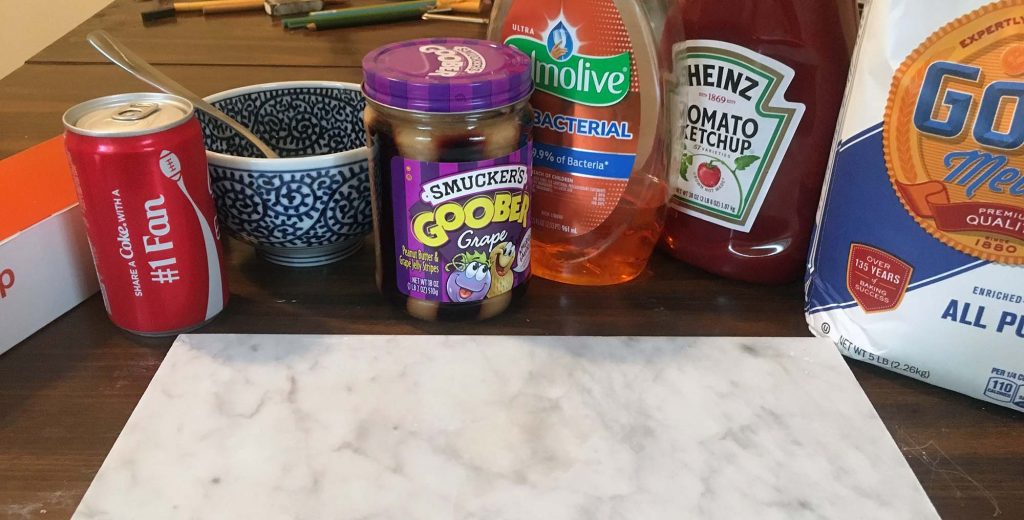
This screenshot has width=1024, height=520. Find the location of `table`. table is located at coordinates (631, 315).